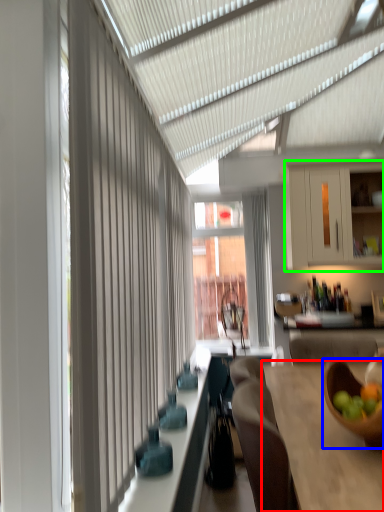
Question: Which is nearer to the table (highlighted by a red box)? bowl (highlighted by a blue box) or cabinetry (highlighted by a green box).

Choices:
 (A) bowl
 (B) cabinetry

Answer: (A)